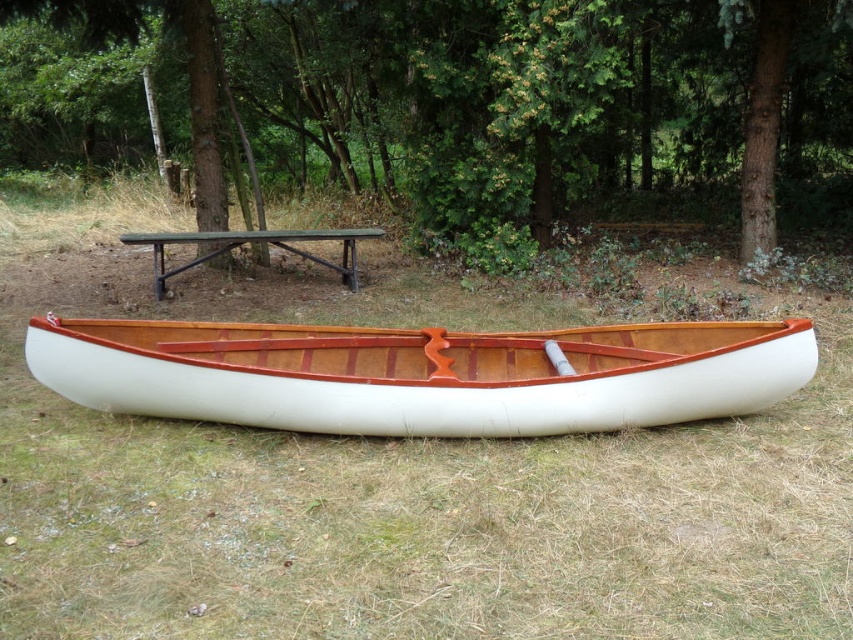
Question: Which object is the farthest from the green leafy tree at center?

Choices:
 (A) white polished wood canoe at center
 (B) green wood picnic table at upper center

Answer: (A)

Question: Does white matte canoe at center appear over green leafy tree at center?

Choices:
 (A) no
 (B) yes

Answer: (A)

Question: Which of the following is the farthest from the observer?

Choices:
 (A) (61, 355)
 (B) (357, 285)
 (C) (421, 77)
 (D) (138, 625)

Answer: (C)

Question: Which of the following is the closest to the observer?

Choices:
 (A) white matte canoe at center
 (B) green leafy tree at center

Answer: (A)

Question: Can you confirm if green leafy tree at center is positioned to the right of white polished wood canoe at center?

Choices:
 (A) yes
 (B) no

Answer: (B)

Question: Can you confirm if white matte canoe at center is bigger than white polished wood canoe at center?

Choices:
 (A) yes
 (B) no

Answer: (A)